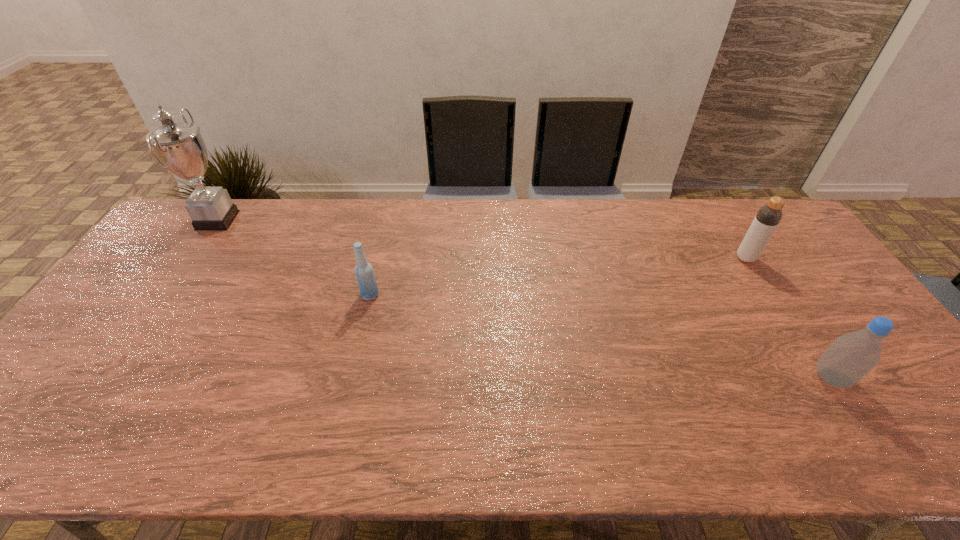
Where is `the leftmost object`? the leftmost object is located at coordinates (181, 150).

At what (x,y) coordinates should I click in order to perform the action: click on the tallest object. Please return your answer as a coordinate pair (x, y). The width and height of the screenshot is (960, 540). Looking at the image, I should click on (181, 150).

At what (x,y) coordinates should I click in order to perform the action: click on the third nearest object. Please return your answer as a coordinate pair (x, y). The image size is (960, 540). Looking at the image, I should click on (768, 217).

Locate an element on the screen. the nearest object is located at coordinates (851, 356).

The width and height of the screenshot is (960, 540). Identify the location of the second object from left to right. (366, 280).

I want to click on the second farthest bottle, so (x=366, y=280).

Locate an element on the screen. This screenshot has width=960, height=540. blank area located 0.230m at the front view of the tallest object is located at coordinates (304, 220).

Locate an element on the screen. vacant area located on the back of the farthest bottle is located at coordinates (724, 222).

This screenshot has height=540, width=960. What are the coordinates of `free location located on the back of the nearest object` in the screenshot? It's located at (762, 272).

Identify the location of vacant area situated 0.170m on the front of the leftmost bottle. This screenshot has width=960, height=540. (357, 351).